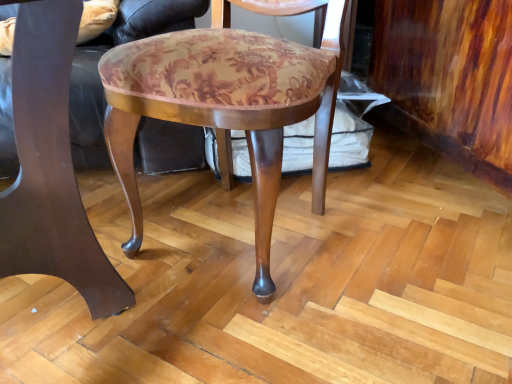
Question: Considering the positions of point (40, 231) and point (270, 283), is point (40, 231) closer or farther from the camera than point (270, 283)?

Choices:
 (A) farther
 (B) closer

Answer: (B)

Question: From the image's perspective, is matte brown wood chair at center, the 1th chair from the left, located above or below wooden chair at center, marked as the second chair in a left-to-right arrangement?

Choices:
 (A) above
 (B) below

Answer: (B)

Question: Relative to wooden chair at center, the first chair when ordered from right to left, is matte brown wood chair at center, the 1th chair from the left, in front or behind?

Choices:
 (A) front
 (B) behind

Answer: (A)

Question: Based on their positions, is wooden chair at center, marked as the second chair in a left-to-right arrangement, located to the left or right of matte brown wood chair at center, the 1th chair from the left?

Choices:
 (A) left
 (B) right

Answer: (B)

Question: From a real-world perspective, is wooden chair at center, the first chair when ordered from right to left, physically located above or below matte brown wood chair at center, arranged as the 2th chair when viewed from the right?

Choices:
 (A) above
 (B) below

Answer: (B)

Question: Considering the positions of wooden chair at center, marked as the second chair in a left-to-right arrangement, and matte brown wood chair at center, the 1th chair from the left, in the image, is wooden chair at center, marked as the second chair in a left-to-right arrangement, taller or shorter than matte brown wood chair at center, the 1th chair from the left,?

Choices:
 (A) tall
 (B) short

Answer: (B)

Question: Considering the positions of wooden chair at center, marked as the second chair in a left-to-right arrangement, and matte brown wood chair at center, arranged as the 2th chair when viewed from the right, in the image, is wooden chair at center, marked as the second chair in a left-to-right arrangement, bigger or smaller than matte brown wood chair at center, arranged as the 2th chair when viewed from the right,?

Choices:
 (A) big
 (B) small

Answer: (A)